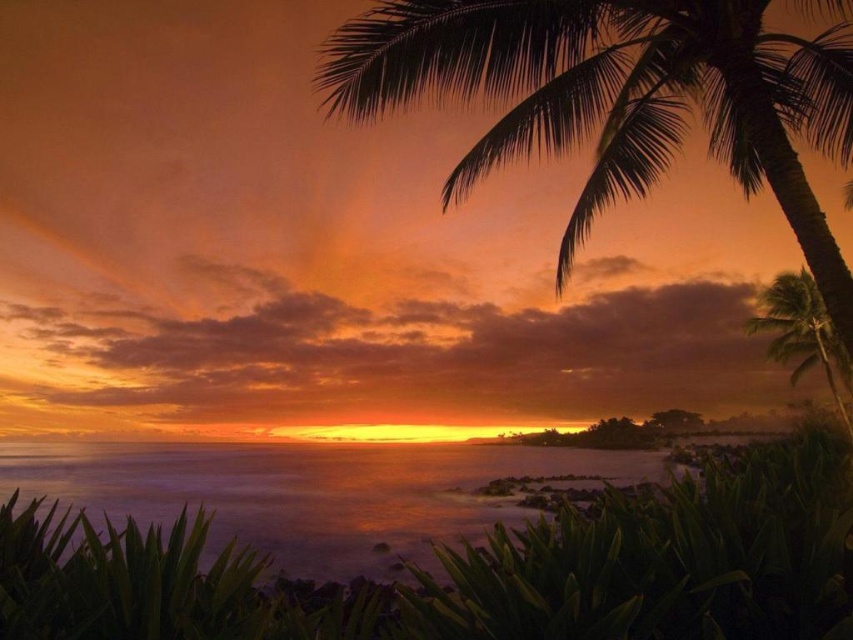
Is translucent water at center above green leafy palm tree at right?

Actually, translucent water at center is below green leafy palm tree at right.

Does translucent water at center appear on the left side of green leafy palm tree at right?

Yes, translucent water at center is to the left of green leafy palm tree at right.

Is point (25, 474) in front of point (780, 304)?

That is True.

Where is `translucent water at center`? translucent water at center is located at coordinates (312, 492).

Between silhouette leafy palm at upper right and translucent water at center, which one is positioned higher?

silhouette leafy palm at upper right is above.

Can you confirm if silhouette leafy palm at upper right is shorter than translucent water at center?

No.

Locate an element on the screen. silhouette leafy palm at upper right is located at coordinates (619, 97).

Where is `silhouette leafy palm at upper right`? This screenshot has height=640, width=853. silhouette leafy palm at upper right is located at coordinates (619, 97).

From the picture: Does silhouette leafy palm at upper right have a greater height compared to green leafy palm tree at right?

No, silhouette leafy palm at upper right is not taller than green leafy palm tree at right.

In the scene shown: Who is higher up, silhouette leafy palm at upper right or green leafy palm tree at right?

silhouette leafy palm at upper right

Is point (653, 129) closer to camera compared to point (816, 307)?

That is True.

The height and width of the screenshot is (640, 853). Identify the location of silhouette leafy palm at upper right. (619, 97).